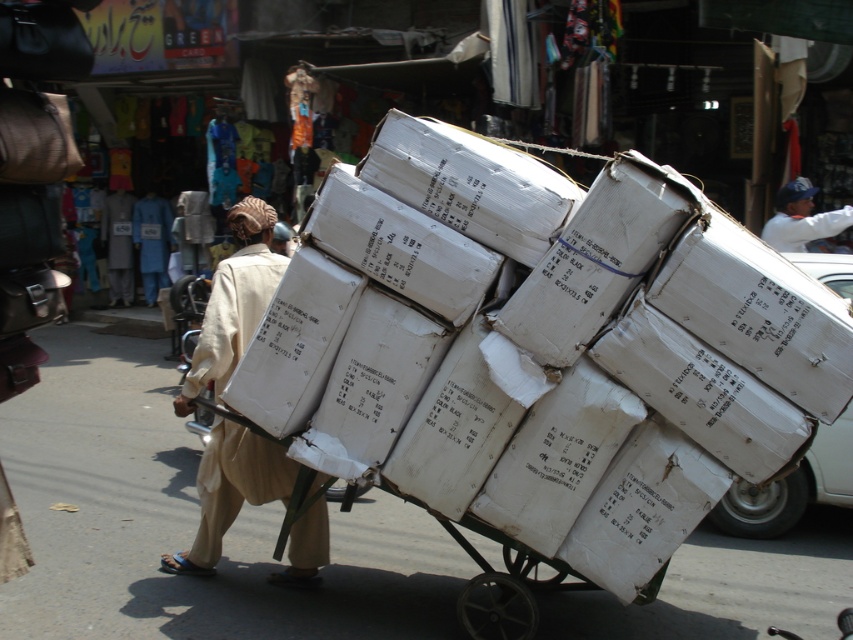
Which is above, white cotton shirt at upper right or light brown cotton robe at center?

light brown cotton robe at center is higher up.

Can you confirm if white cotton shirt at upper right is wider than light brown cotton robe at center?

Yes.

Which is behind, point (772, 216) or point (131, 289)?

Positioned behind is point (131, 289).

The width and height of the screenshot is (853, 640). Identify the location of white cotton shirt at upper right. [801, 218].

Is white cardboard boxes at center bigger than light brown cotton robe at center?

Yes, white cardboard boxes at center is bigger than light brown cotton robe at center.

Is white cardboard boxes at center shorter than light brown cotton robe at center?

No.

Which is in front, point (252, 305) or point (115, 275)?

Point (252, 305) is more forward.

This screenshot has width=853, height=640. What are the coordinates of `white cardboard boxes at center` in the screenshot? It's located at (234, 300).

Which of these two, white cardboard boxes at center or blue cotton robe at center, stands shorter?

blue cotton robe at center

Which is below, white cardboard boxes at center or blue cotton robe at center?

Positioned lower is white cardboard boxes at center.

Who is more forward, (225,323) or (155,221)?

Positioned in front is point (225,323).

You are a GUI agent. You are given a task and a screenshot of the screen. Output one action in this format:
    pyautogui.click(x=<x>, y=<y>)
    Task: Click on the white cardboard boxes at center
    This screenshot has width=853, height=640.
    Given the screenshot: What is the action you would take?
    pyautogui.click(x=234, y=300)